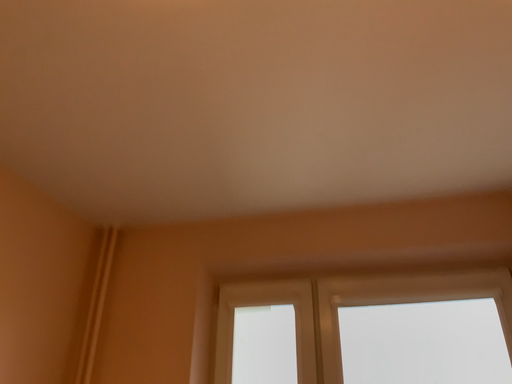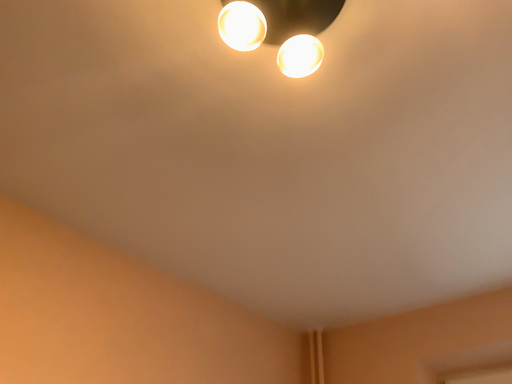
Question: How did the camera likely rotate when shooting the video?

Choices:
 (A) rotated right
 (B) rotated left

Answer: (B)